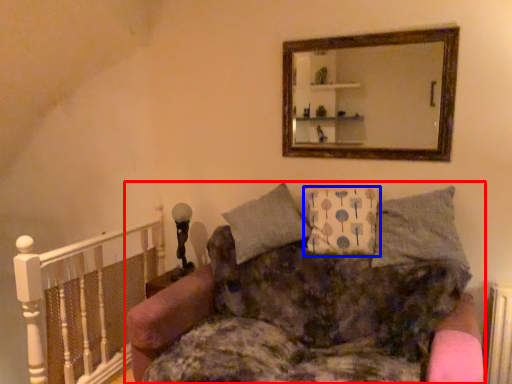
Question: Which object is further to the camera taking this photo, studio couch (highlighted by a red box) or pillow (highlighted by a blue box)?

Choices:
 (A) studio couch
 (B) pillow

Answer: (B)